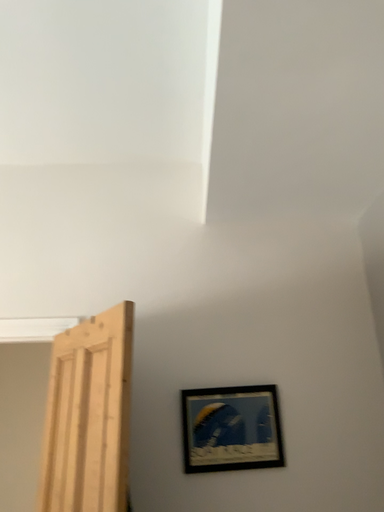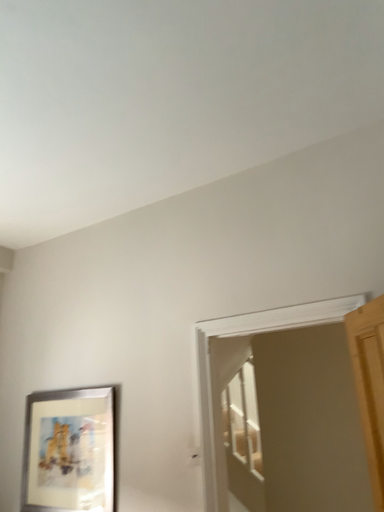
Question: How did the camera likely rotate when shooting the video?

Choices:
 (A) rotated left
 (B) rotated right

Answer: (A)